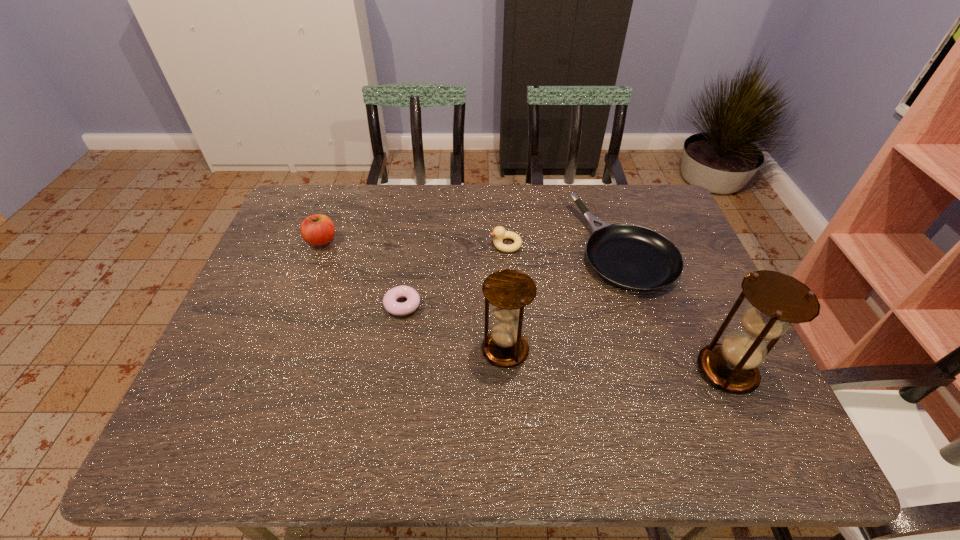
Find the location of a particular element. the left hourglass is located at coordinates (508, 291).

Identify the location of the shorter hourglass. The height and width of the screenshot is (540, 960). tap(508, 291).

What are the coordinates of `the right hourglass` in the screenshot? It's located at (777, 300).

The height and width of the screenshot is (540, 960). What are the coordinates of `the tallest object` in the screenshot? It's located at (777, 300).

Where is `the fourth shortest object`? This screenshot has height=540, width=960. the fourth shortest object is located at coordinates (317, 230).

Locate an element on the screen. Image resolution: width=960 pixels, height=540 pixels. the leftmost object is located at coordinates (317, 230).

At what (x,y) coordinates should I click in order to perform the action: click on pan. Please return your answer as a coordinate pair (x, y). The height and width of the screenshot is (540, 960). Looking at the image, I should click on (633, 257).

Identify the location of the shortest object. This screenshot has height=540, width=960. (390, 303).

The width and height of the screenshot is (960, 540). Identify the location of doughnut. (390, 303).

Locate an element on the screen. The image size is (960, 540). duckling is located at coordinates (499, 232).